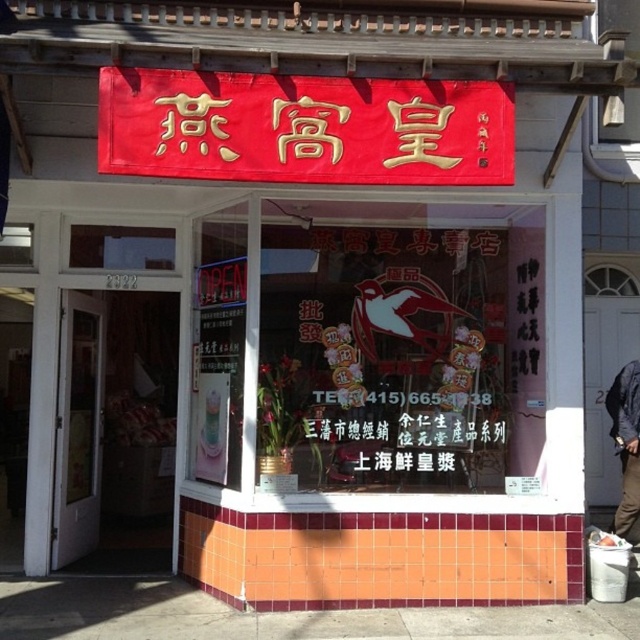
Does transparent glass window at center have a smaller size compared to dark blue jacket at lower right?

No, transparent glass window at center is not smaller than dark blue jacket at lower right.

What are the coordinates of `transparent glass window at center` in the screenshot? It's located at (396, 348).